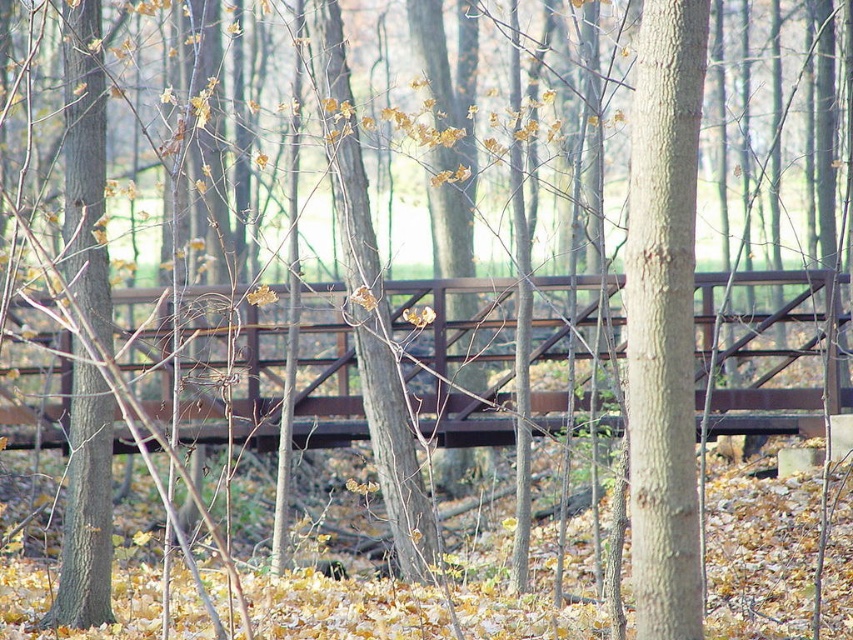
Can you confirm if brown metal bridge at center is positioned above smooth gray bark at center?

No.

Who is positioned more to the right, brown metal bridge at center or smooth gray bark at center?

From the viewer's perspective, smooth gray bark at center appears more on the right side.

Is point (339, 307) behind point (688, 266)?

Yes, it is.

Find the location of a particular element. Image resolution: width=853 pixels, height=640 pixels. brown metal bridge at center is located at coordinates (772, 353).

Is smooth gray bark at center taller than smooth brown tree trunk at left?

In fact, smooth gray bark at center may be shorter than smooth brown tree trunk at left.

Does smooth gray bark at center appear under smooth brown tree trunk at left?

Yes, smooth gray bark at center is below smooth brown tree trunk at left.

Who is more forward, (654, 531) or (96, 483)?

Point (654, 531) is more forward.

Where is `smooth gray bark at center`? smooth gray bark at center is located at coordinates pyautogui.click(x=663, y=317).

Which is below, brown metal bridge at center or smooth brown tree trunk at left?

brown metal bridge at center is below.

Is brown metal bridge at center thinner than smooth brown tree trunk at left?

No.

Which is in front, point (560, 321) or point (94, 524)?

Point (94, 524) is more forward.

I want to click on brown metal bridge at center, so click(772, 353).